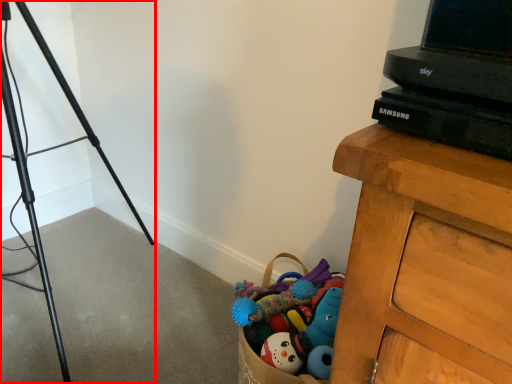
Question: From the image's perspective, where is tripod (annotated by the red box) located in relation to computer in the image?

Choices:
 (A) above
 (B) below

Answer: (B)